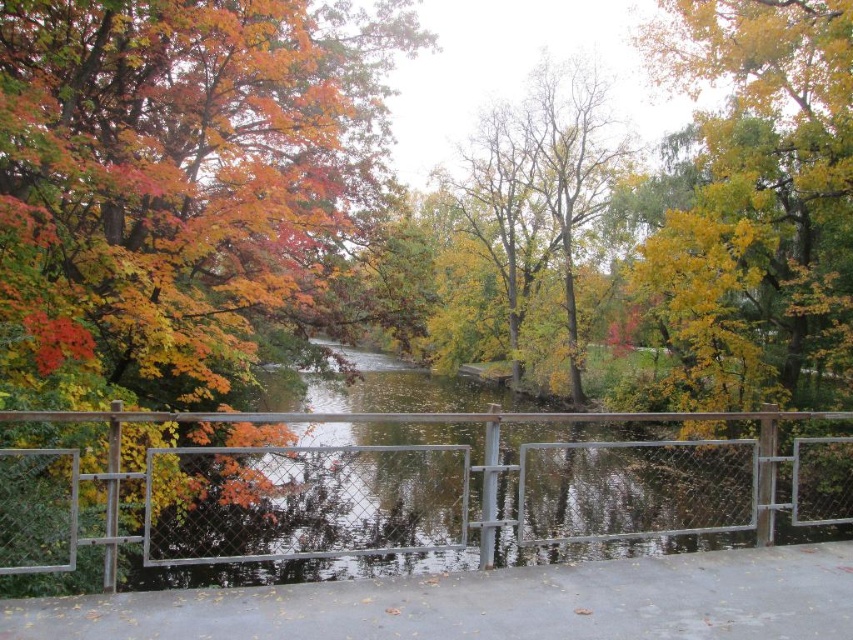
Does metal chain-link fence at center appear on the right side of bare wood tree at center?

No, metal chain-link fence at center is not to the right of bare wood tree at center.

Between point (322, 449) and point (570, 132), which one is positioned in front?

Point (322, 449) is in front.

Who is more forward, (819, 452) or (486, 177)?

Point (819, 452) is in front.

At what (x,y) coordinates should I click in order to perform the action: click on metal chain-link fence at center. Please return your answer as a coordinate pair (x, y). This screenshot has width=853, height=640. Looking at the image, I should click on (421, 488).